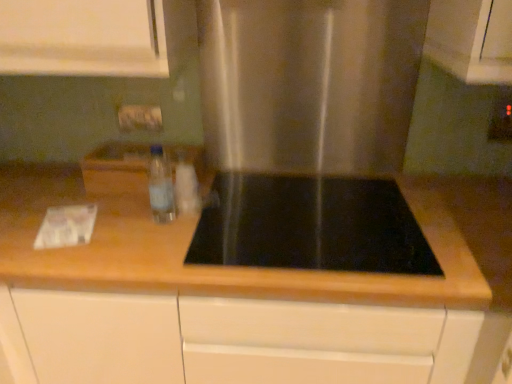
Locate an element on the screen. The height and width of the screenshot is (384, 512). vacant point to the left of translucent plastic bottle at center, acting as the second bottle starting from the left is located at coordinates (116, 206).